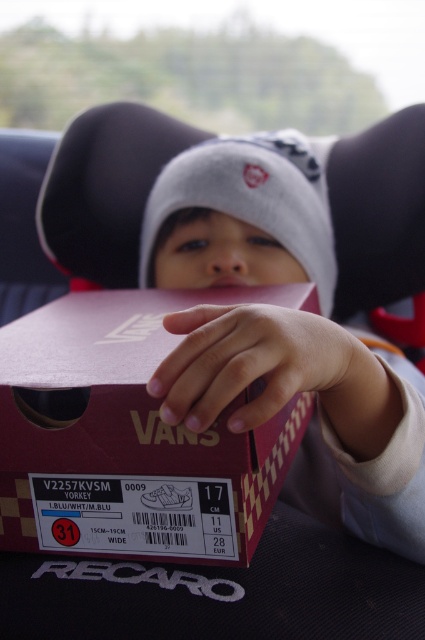
Question: Which point is closer to the camera?

Choices:
 (A) (90, 472)
 (B) (363, 296)

Answer: (A)

Question: Is matte gray beanie at center to the left of matte red shoebox at center from the viewer's perspective?

Choices:
 (A) yes
 (B) no

Answer: (B)

Question: Among these objects, which one is nearest to the camera?

Choices:
 (A) matte red shoebox at center
 (B) matte gray beanie at center

Answer: (B)

Question: From the image, what is the correct spatial relationship of matte gray beanie at center in relation to matte red shoebox at center?

Choices:
 (A) above
 (B) below

Answer: (A)

Question: Can you confirm if matte gray beanie at center is smaller than matte red shoebox at center?

Choices:
 (A) no
 (B) yes

Answer: (A)